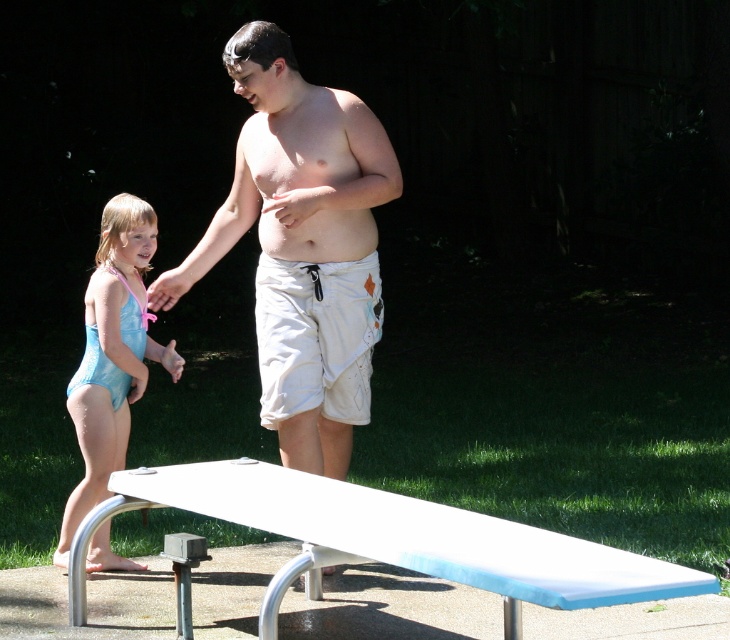
Who is positioned more to the right, white glossy diving board at center or light blue swimsuit at left?

white glossy diving board at center is more to the right.

Does white glossy diving board at center have a larger size compared to light blue swimsuit at left?

Correct, white glossy diving board at center is larger in size than light blue swimsuit at left.

Is point (269, 470) closer to camera compared to point (119, 301)?

Yes, it is in front of point (119, 301).

I want to click on white glossy diving board at center, so click(385, 540).

Between white cotton shorts at center and light blue swimsuit at left, which one is positioned higher?

Positioned higher is white cotton shorts at center.

Between white cotton shorts at center and light blue swimsuit at left, which one has more height?

Standing taller between the two is white cotton shorts at center.

Which is in front, point (253, 125) or point (107, 291)?

Point (107, 291)

The image size is (730, 640). In order to click on white cotton shorts at center in this screenshot , I will do `click(301, 246)`.

Does white cotton shorts at center appear over white glossy diving board at center?

Yes, white cotton shorts at center is above white glossy diving board at center.

The height and width of the screenshot is (640, 730). I want to click on white cotton shorts at center, so click(301, 246).

Image resolution: width=730 pixels, height=640 pixels. What are the coordinates of `white cotton shorts at center` in the screenshot? It's located at (301, 246).